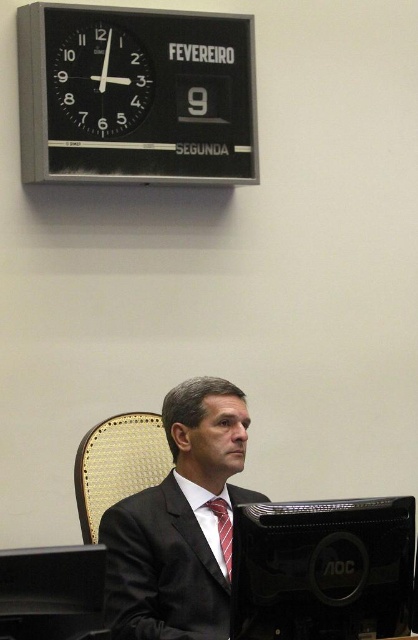
You are an office worker who needs to check the time displayed on the black plastic clock at upper left and the woven fabric chair at center. Which object is closer to you as you look at the scene?

The black plastic clock at upper left is closer to you than the woven fabric chair at center because it is further to the viewer.